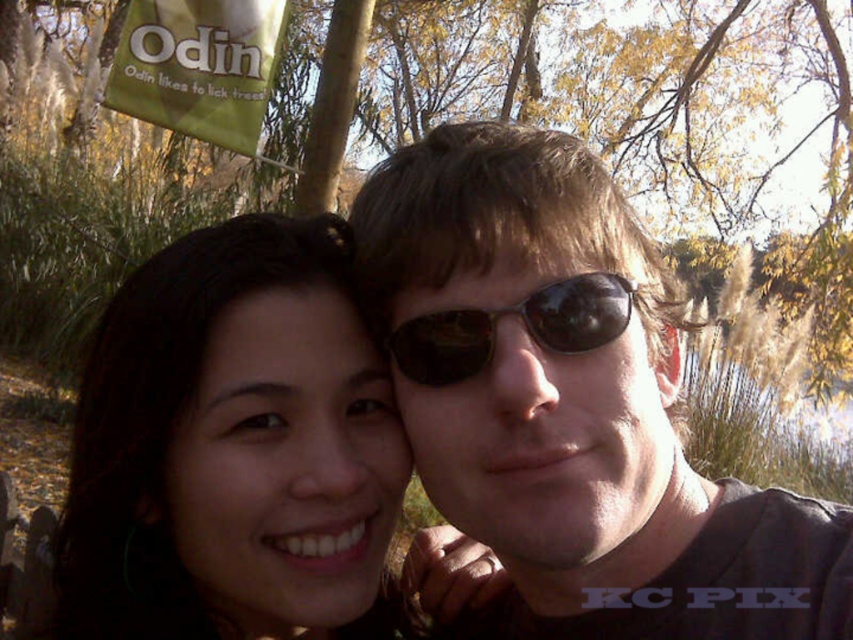
Can you confirm if matte black sunglasses at center is shorter than black reflective sunglasses at center?

In fact, matte black sunglasses at center may be taller than black reflective sunglasses at center.

Does matte black sunglasses at center have a lesser width compared to black reflective sunglasses at center?

No.

Measure the distance between matte black sunglasses at center and camera.

26.45 inches

You are a GUI agent. You are given a task and a screenshot of the screen. Output one action in this format:
    pyautogui.click(x=<x>, y=<y>)
    Task: Click on the matte black sunglasses at center
    This screenshot has width=853, height=640.
    Given the screenshot: What is the action you would take?
    pyautogui.click(x=572, y=404)

Is matte black sunglasses at center above dark brown hair at center?

Yes.

Based on the photo, which of these two, matte black sunglasses at center or dark brown hair at center, stands shorter?

dark brown hair at center

Locate an element on the screen. matte black sunglasses at center is located at coordinates (572, 404).

Does dark brown hair at center come in front of black reflective sunglasses at center?

That is False.

Which of these two, dark brown hair at center or black reflective sunglasses at center, stands shorter?

black reflective sunglasses at center is shorter.

You are a GUI agent. You are given a task and a screenshot of the screen. Output one action in this format:
    pyautogui.click(x=<x>, y=<y>)
    Task: Click on the dark brown hair at center
    The image size is (853, 640).
    Given the screenshot: What is the action you would take?
    pyautogui.click(x=233, y=448)

Image resolution: width=853 pixels, height=640 pixels. What are the coordinates of `dark brown hair at center` in the screenshot? It's located at (233, 448).